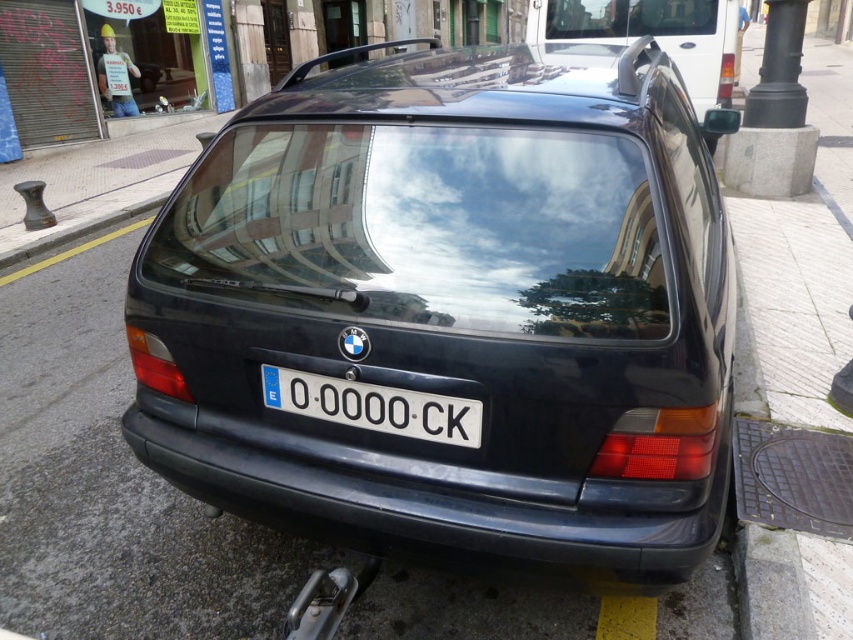
Question: Is glossy black car at center further to the viewer compared to glossy black roof rack at upper right?

Choices:
 (A) yes
 (B) no

Answer: (B)

Question: In this image, where is glossy black car at center located relative to glossy black roof rack at upper right?

Choices:
 (A) right
 (B) left

Answer: (B)

Question: Which point appears farthest from the camera in this image?

Choices:
 (A) (561, 360)
 (B) (281, 374)
 (C) (737, 81)

Answer: (C)

Question: Can you confirm if glossy black roof rack at upper right is bigger than white plastic license plate at center?

Choices:
 (A) no
 (B) yes

Answer: (B)

Question: Which of the following is the farthest from the observer?

Choices:
 (A) glossy black roof rack at upper right
 (B) white plastic license plate at center
 (C) glossy black car at center

Answer: (A)

Question: Which object is the closest to the glossy black roof rack at upper right?

Choices:
 (A) white plastic license plate at center
 (B) glossy black car at center

Answer: (B)